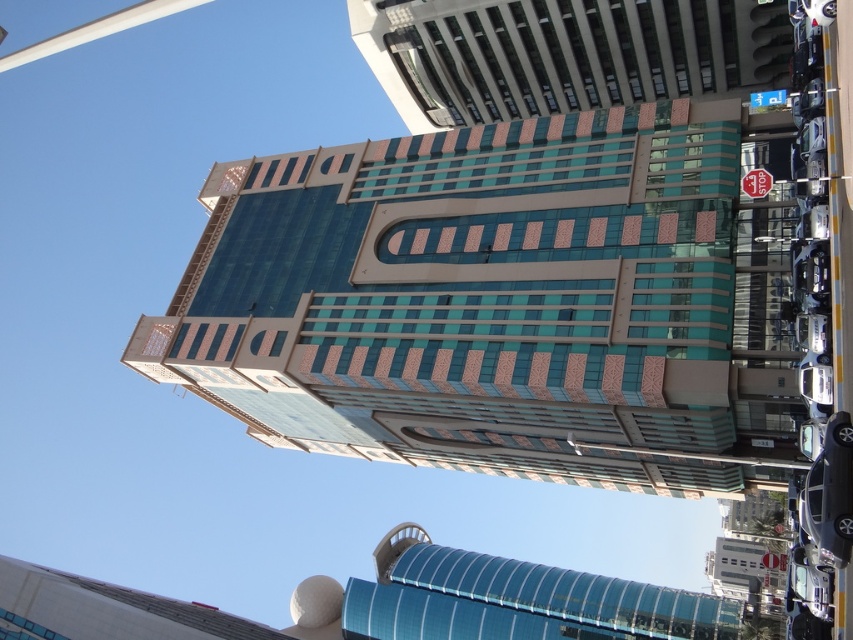
Question: Which object is closer to the camera taking this photo?

Choices:
 (A) red plastic stop sign at upper right
 (B) teal glass building at center

Answer: (B)

Question: Does teal glass building at center have a larger size compared to red plastic stop sign at upper right?

Choices:
 (A) yes
 (B) no

Answer: (A)

Question: Is teal glass building at center smaller than red plastic stop sign at upper right?

Choices:
 (A) no
 (B) yes

Answer: (A)

Question: Can you confirm if teal glass building at center is bigger than red plastic stop sign at upper right?

Choices:
 (A) no
 (B) yes

Answer: (B)